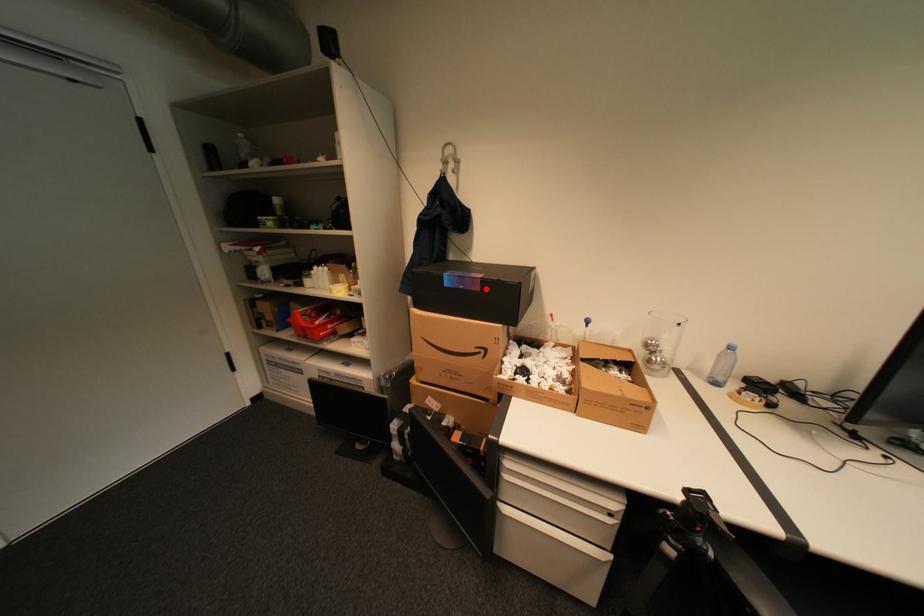
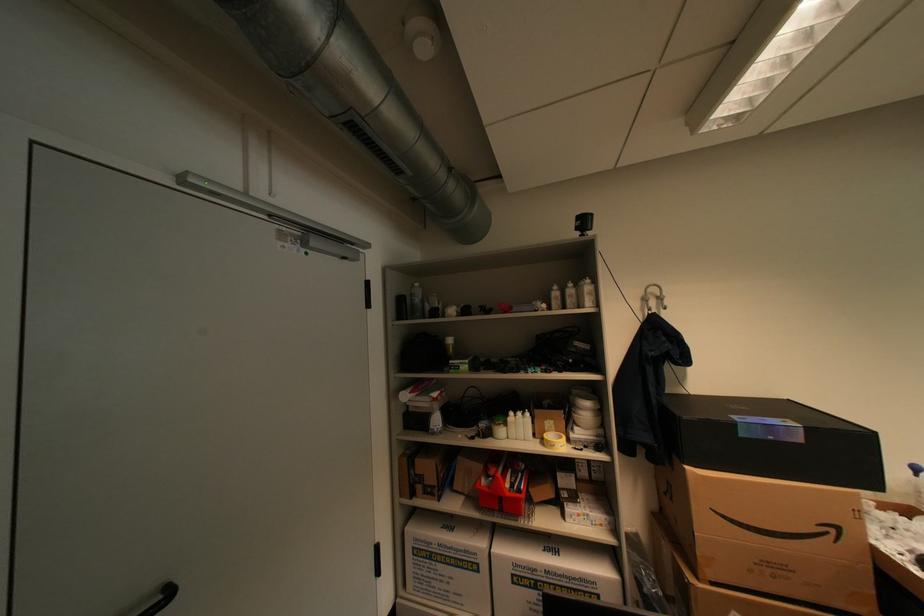
Question: I am providing you with two images of the same scene from different viewpoints. In image1, a red point is highlighted. Considering the same 3D point in image2, which of the following is correct?

Choices:
 (A) It is closer
 (B) It is farther

Answer: (A)